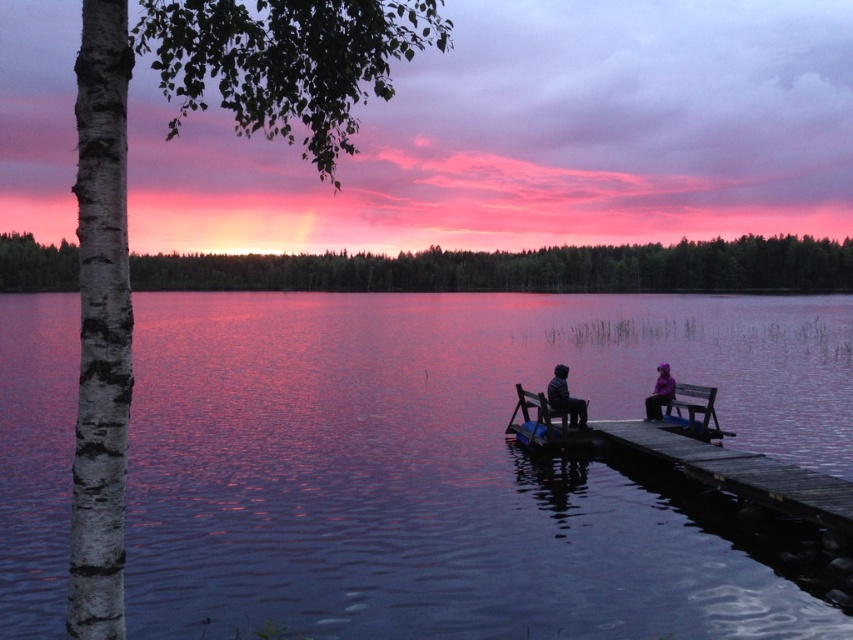
You are standing at the point marked as point (741, 472) in the image. What object is directly in front of you?

The wooden dock at lower right is located at point (741, 472), so the object directly in front of you is the wooden dock at lower right.